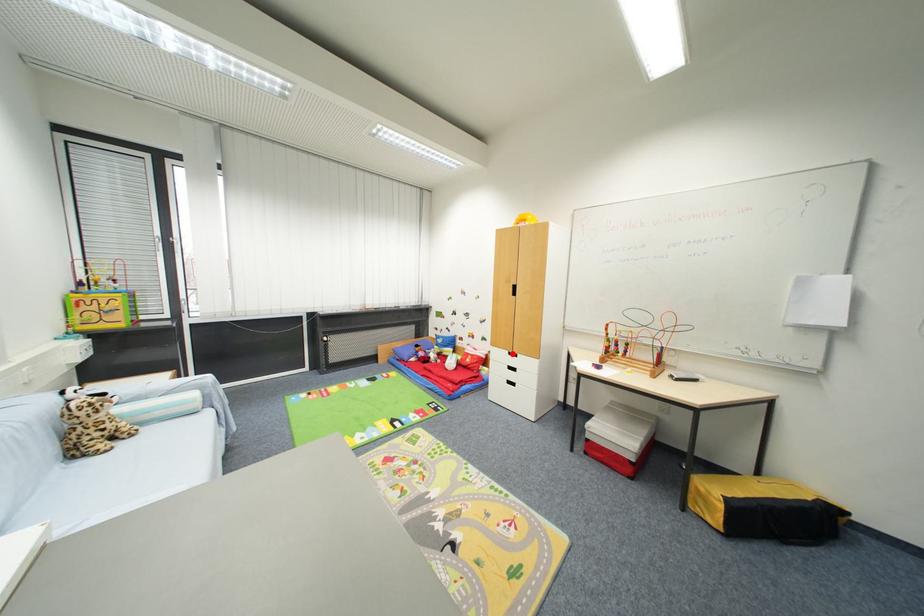
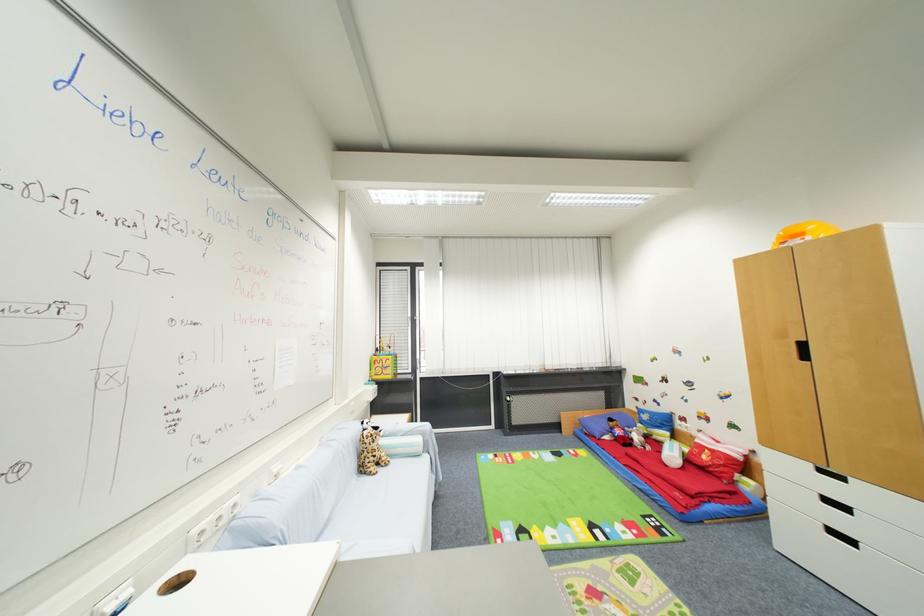
In the second image, find the point that corresponds to the highlighted location in the first image.

(816, 467)